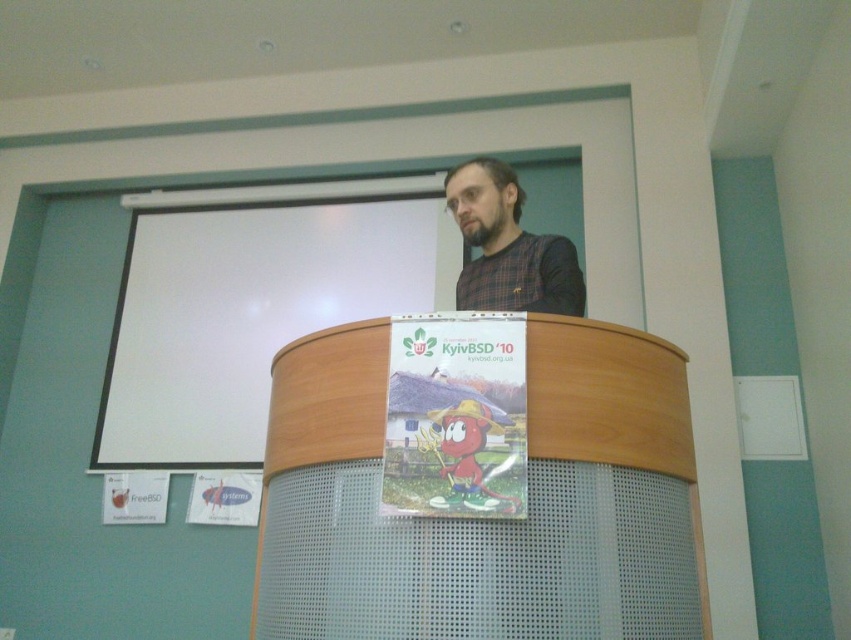
You are a photographer positioned behind the man at the wooden podium at center. You want to take a photo of the plaid fabric shirt at center without the podium blocking it. Is this possible?

The wooden podium at center is in front of the plaid fabric shirt at center, so the podium is already blocking the shirt. Therefore, it is not possible to take a photo of the plaid fabric shirt at center without the podium blocking it.

You are an event organizer setting up a presentation. You need to position a speaker system between the wooden podium at center and the white matte projection screen at upper center. Based on their positions, which side of the speaker system should face towards the audience? Please explain your reasoning.

The wooden podium at center is to the right of the white matte projection screen at upper center. Therefore, the speaker system should be placed between them with its front facing towards the audience, which would be the side opposite the projection screen. This ensures the sound is directed towards the audience rather than the screen.